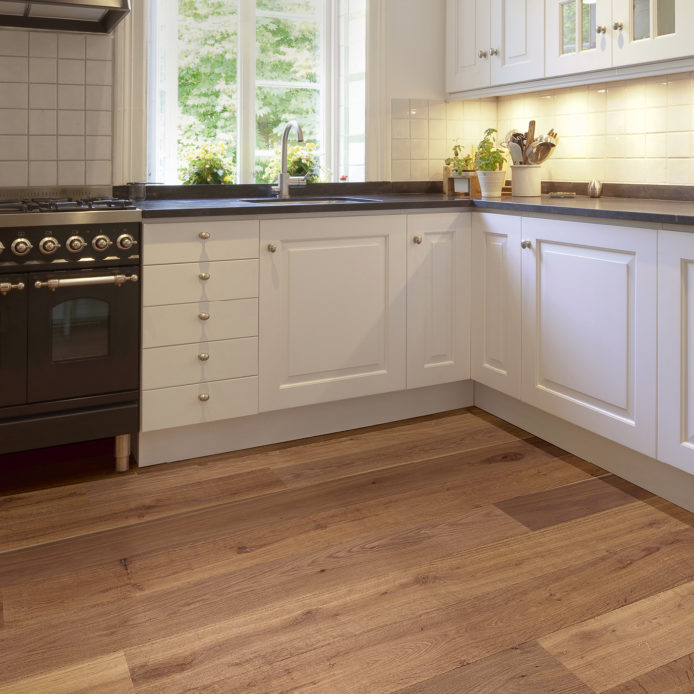
This screenshot has width=694, height=694. I want to click on plant, so click(205, 171), click(304, 160), click(459, 168), click(484, 152).